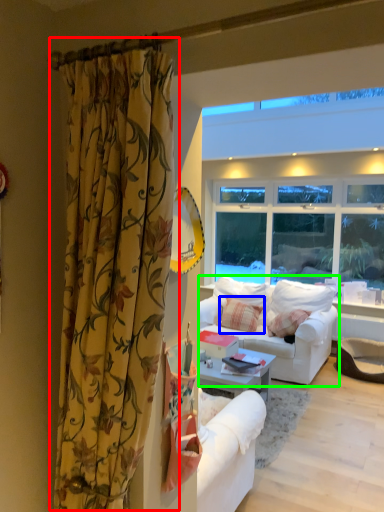
Question: Based on their relative distances, which object is farther from curtain (highlighted by a red box)? Choose from pillow (highlighted by a blue box) and studio couch (highlighted by a green box).

Choices:
 (A) pillow
 (B) studio couch

Answer: (A)